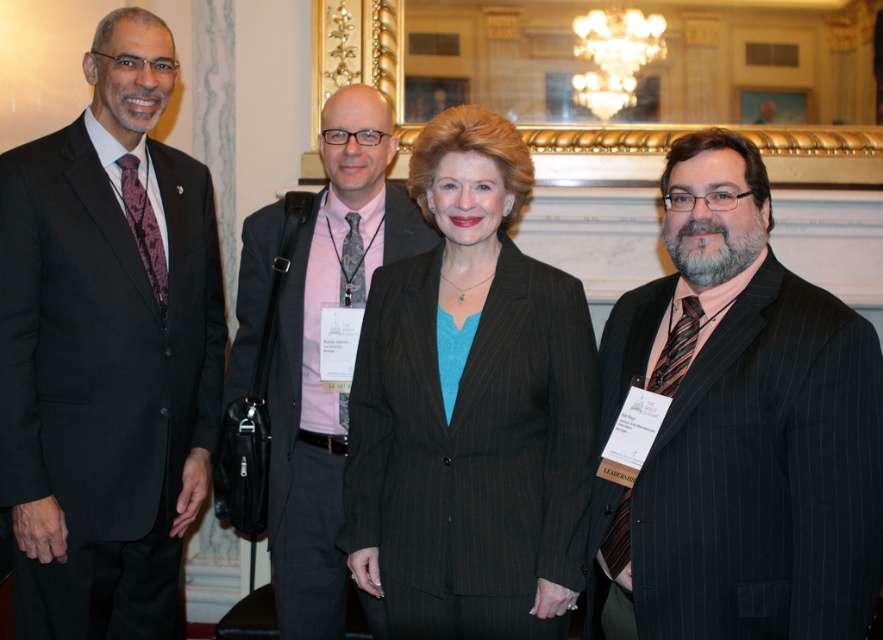
Question: In this image, where is matte black suit at right located relative to pink fabric shirt at center?

Choices:
 (A) left
 (B) right

Answer: (B)

Question: Where is matte black suit at right located in relation to pink fabric shirt at center in the image?

Choices:
 (A) left
 (B) right

Answer: (B)

Question: Can you confirm if matte black suit at left is positioned below pink fabric shirt at center?

Choices:
 (A) no
 (B) yes

Answer: (A)

Question: Which is nearer to the brown pinstripe suit at center?

Choices:
 (A) matte black suit at left
 (B) matte black suit at right

Answer: (B)

Question: Which object appears farthest from the camera in this image?

Choices:
 (A) matte black suit at right
 (B) matte black suit at left

Answer: (B)

Question: Based on their relative distances, which object is nearer to the brown pinstripe suit at center?

Choices:
 (A) pink fabric shirt at center
 (B) matte black suit at left

Answer: (A)